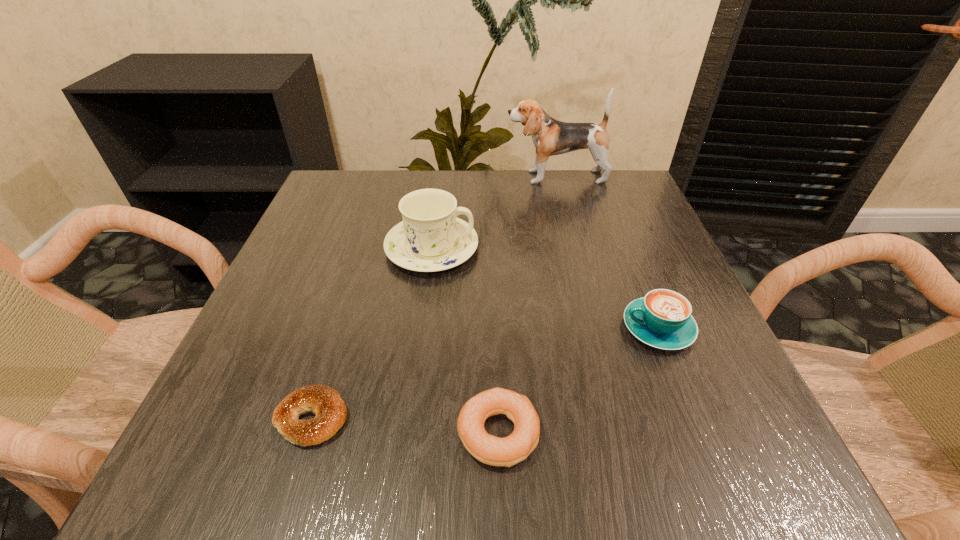
Where is `chinaware located in the far edge section of the desktop`? The image size is (960, 540). chinaware located in the far edge section of the desktop is located at coordinates (431, 238).

You are a GUI agent. You are given a task and a screenshot of the screen. Output one action in this format:
    pyautogui.click(x=<x>, y=<y>)
    Task: Click on the object located at the left edge
    
    Given the screenshot: What is the action you would take?
    pyautogui.click(x=322, y=400)

Where is `puppy positioned at the right edge`? Image resolution: width=960 pixels, height=540 pixels. puppy positioned at the right edge is located at coordinates (550, 137).

Locate an element on the screen. Image resolution: width=960 pixels, height=540 pixels. cappuccino located at the right edge is located at coordinates (662, 319).

Identify the location of object located at the near left corner. (322, 400).

The width and height of the screenshot is (960, 540). In order to click on object that is at the far right corner in this screenshot , I will do `click(550, 137)`.

Locate an element on the screen. This screenshot has width=960, height=540. blank area at the far edge is located at coordinates (494, 186).

The height and width of the screenshot is (540, 960). I want to click on vacant space at the near edge of the desktop, so click(438, 475).

Image resolution: width=960 pixels, height=540 pixels. In the image, there is a desktop. In order to click on blank space at the left edge in this screenshot , I will do `click(320, 231)`.

Find the location of `vacant space at the right edge of the desktop`. vacant space at the right edge of the desktop is located at coordinates tap(680, 377).